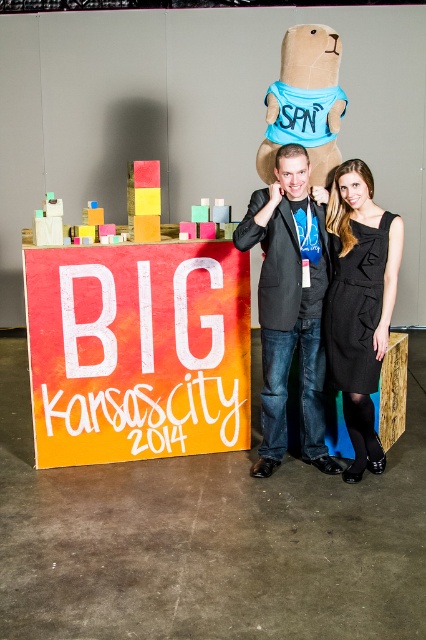
You are a photographer trying to decide whether to adjust the camera angle to ensure both the matte black blazer at center and the black textured dress at center are fully visible in the frame. Based on their heights, which one might require you to angle the camera upwards more?

The matte black blazer at center is taller than the black textured dress at center, so you would need to angle the camera upwards more to capture the taller blazer fully.

You are organizing a charity event and need to decide if a mannequin that can only hold items up to 1.2 meters wide can accommodate both the matte black blazer at center and the black textured dress at center displayed side by side. Based on the image description, can the mannequin fit both items together?

The matte black blazer at center might be wider than black textured dress at center, so it is uncertain if the combined width of both items would exceed the mannequin capacity. Further measurement is needed.